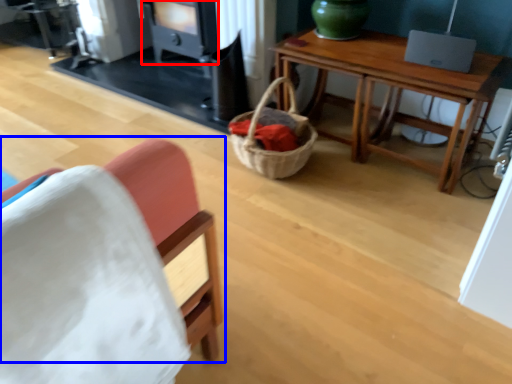
Question: Which of the following is the farthest to the observer, stove (highlighted by a red box) or chair (highlighted by a blue box)?

Choices:
 (A) stove
 (B) chair

Answer: (A)